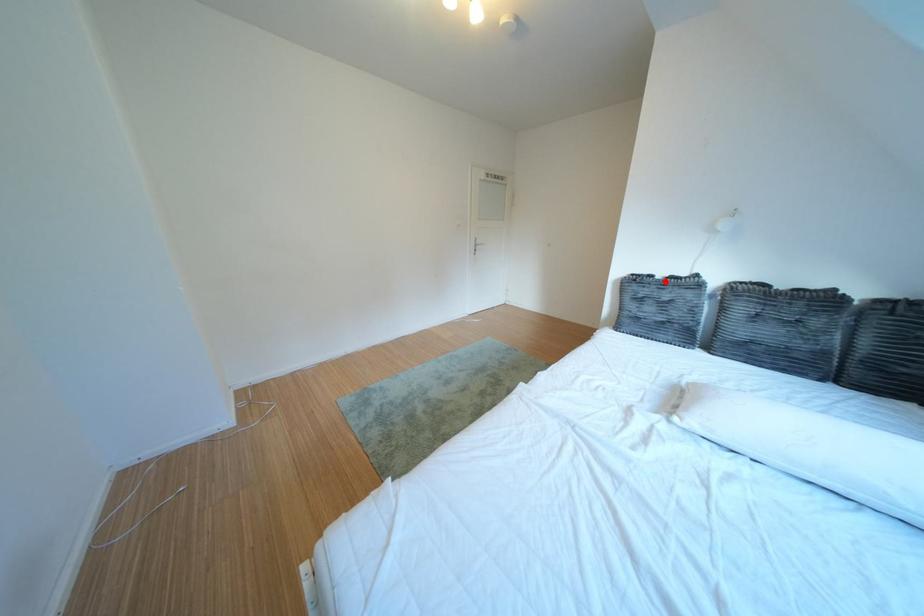
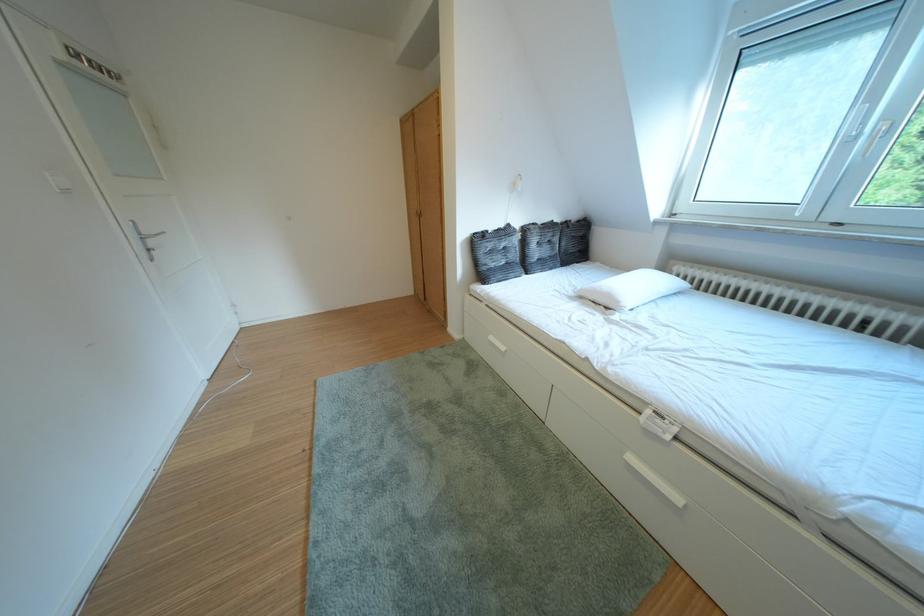
Question: I am providing you with two images of the same scene from different viewpoints. Given a red point in image1, look at the same physical point in image2. Is it:

Choices:
 (A) Closer to the viewpoint
 (B) Farther from the viewpoint

Answer: (A)